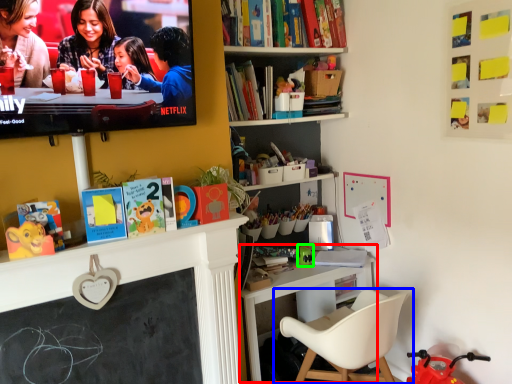
Question: Which object is the farthest from table (highlighted by a red box)? Choose among these: chair (highlighted by a blue box) or toy (highlighted by a green box).

Choices:
 (A) chair
 (B) toy

Answer: (A)